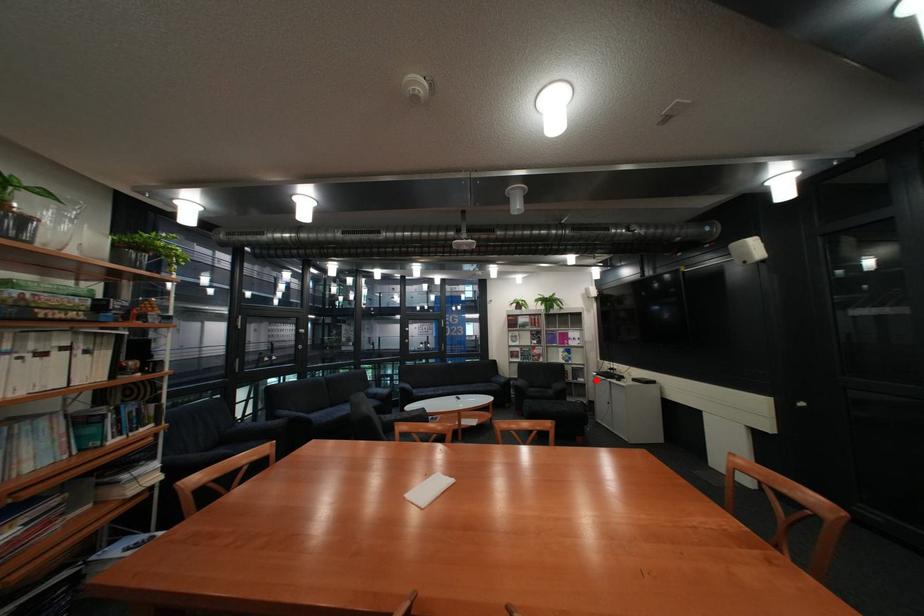
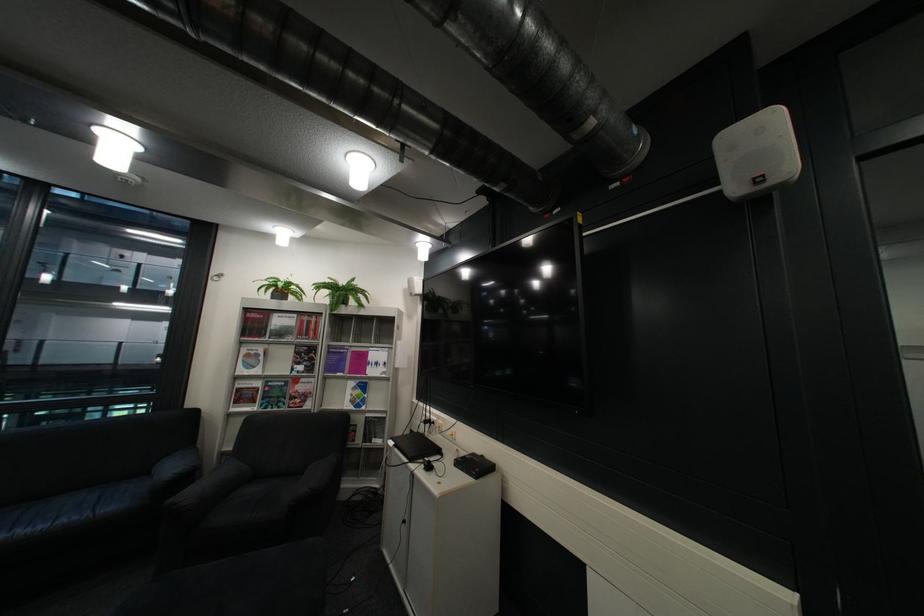
Find the pixel in the second image that matches the highlighted location in the first image.

(393, 442)